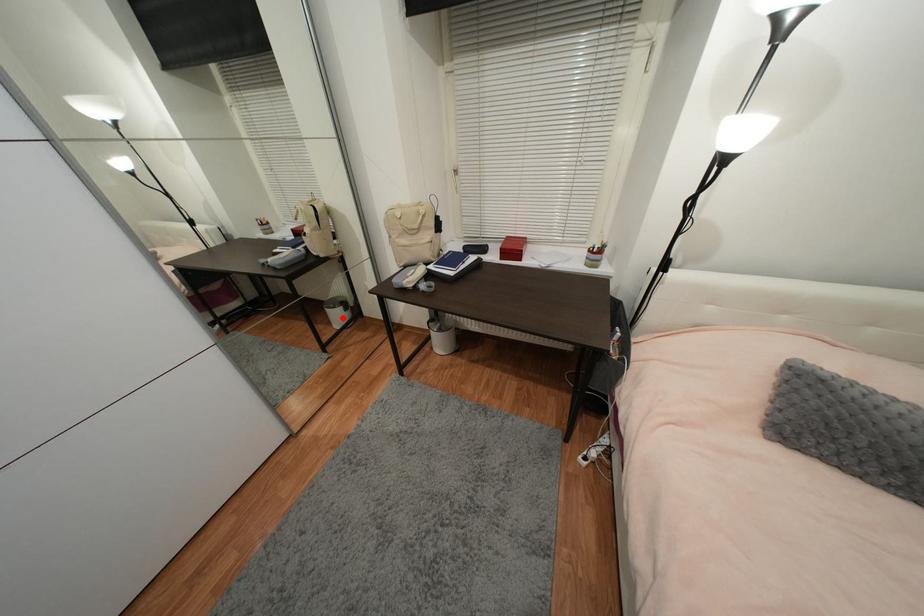
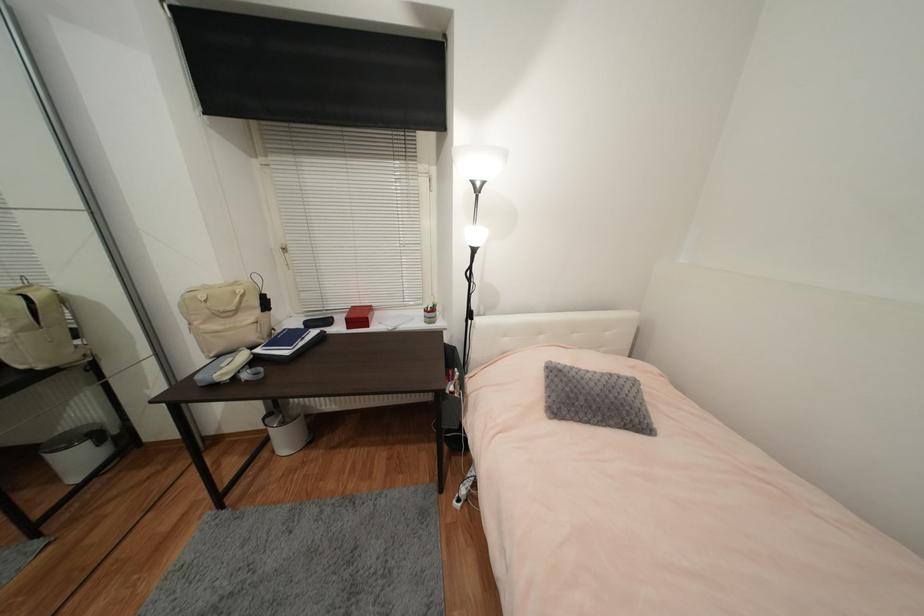
Question: I am providing you with two images of the same scene from different viewpoints. Image1 has a red point marked. In image2, the corresponding 3D location appears at what relative position? Reply with the corresponding letter.

Choices:
 (A) Closer
 (B) Farther

Answer: (B)